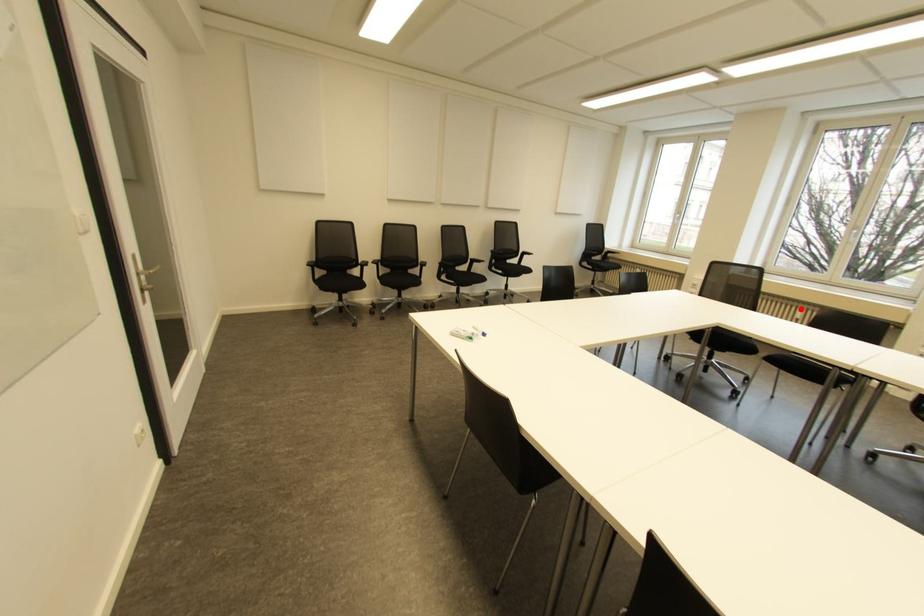
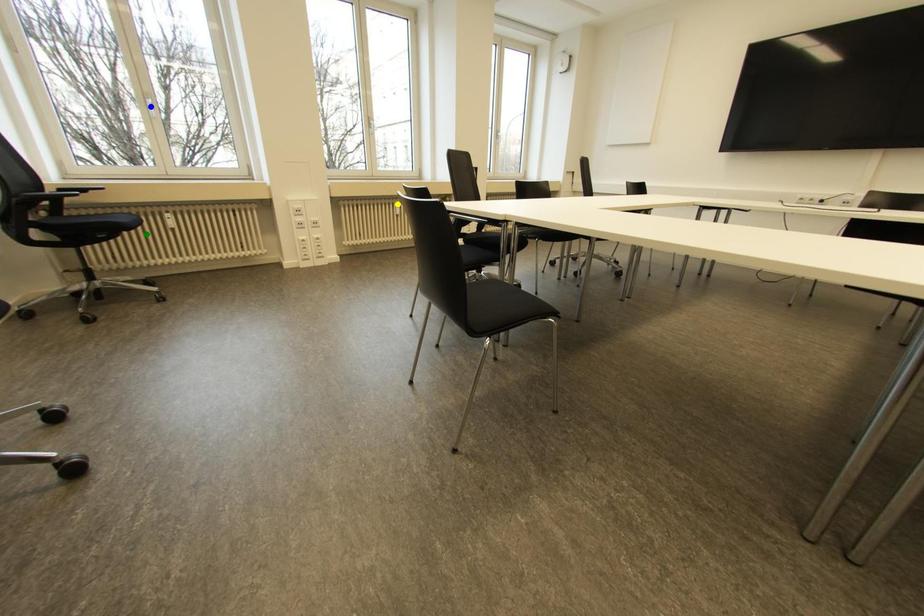
Question: I am providing you with two images of the same scene from different viewpoints. A red point is marked on the first image. You are given multiple points on the second image. In image 2, which mark is for the same physical point as the one in image 1?

Choices:
 (A) green point
 (B) blue point
 (C) yellow point

Answer: (C)